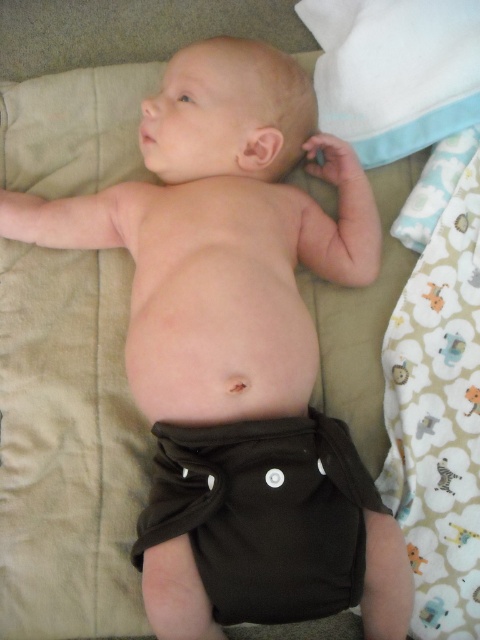
Where is the brown fabric diaper at center located in the image?

The brown fabric diaper at center is located at point 0.805 on the x axis and 0.550 on the y axis.

You are a parent preparing to change your baby. You see the brown fabric diaper at center and the white fabric at lower right. Which fabric takes up more area in the image?

The white fabric at lower right takes up more area than the brown fabric diaper at center because the brown fabric diaper at center occupies less space than white fabric at lower right.